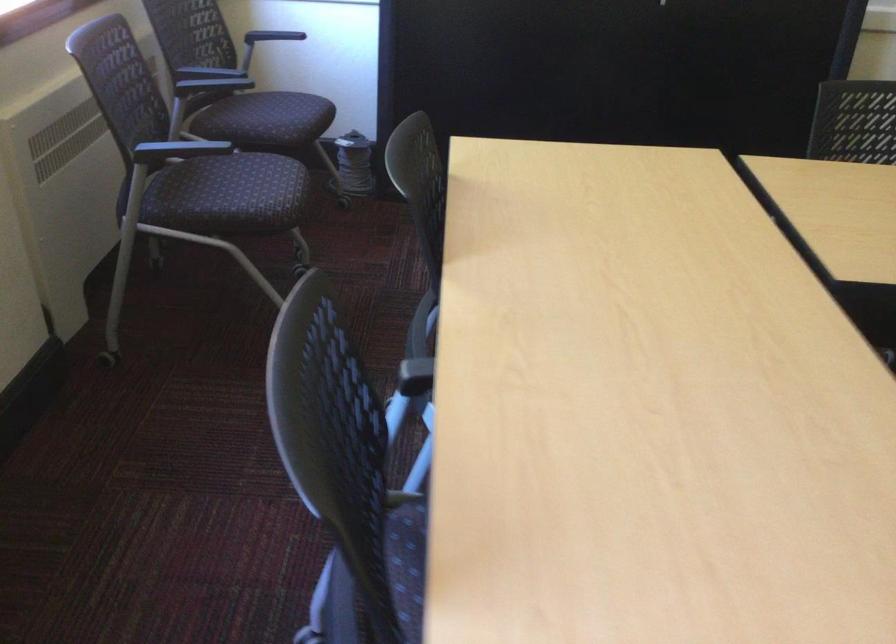
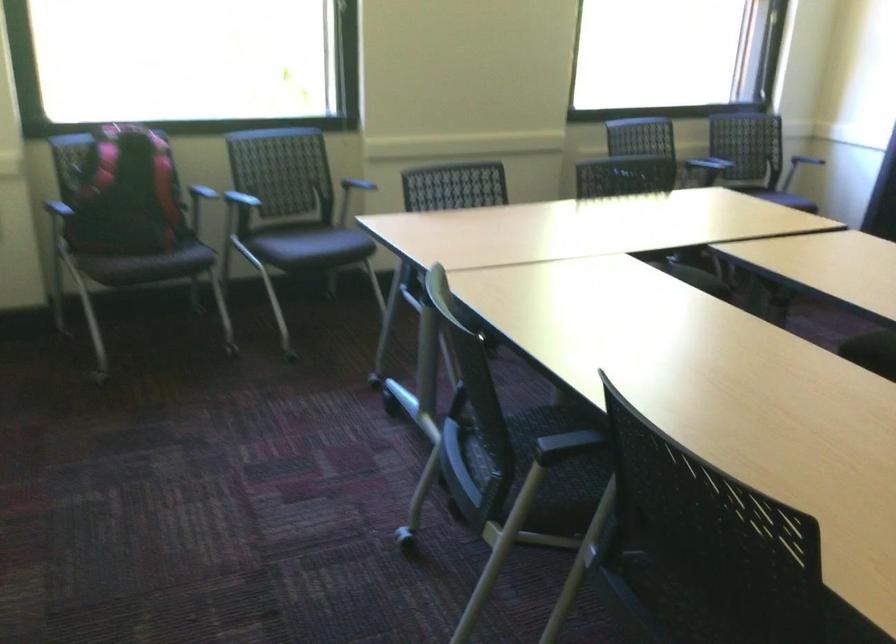
Question: I am providing you with two images of the same scene from different viewpoints. After the viewpoint changes to image2, which objects are now occluded?

Choices:
 (A) chair armrest
 (B) red and black backpack
 (C) chair sitting surface
 (D) gray chair surface

Answer: (C)